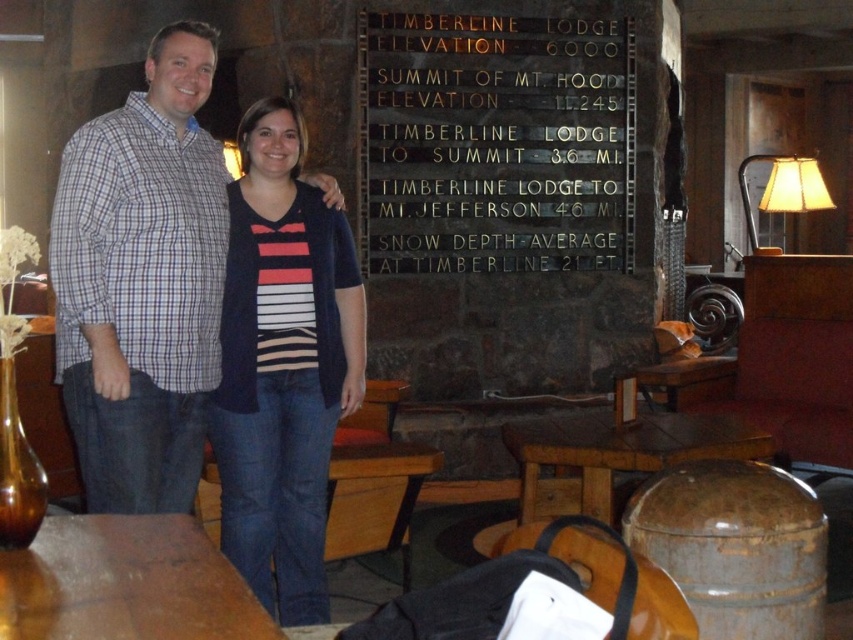
Find the location of `plaid cotton shirt at center`. plaid cotton shirt at center is located at coordinates (142, 282).

Where is `plaid cotton shirt at center`? plaid cotton shirt at center is located at coordinates (142, 282).

This screenshot has width=853, height=640. Find the location of `plaid cotton shirt at center`. plaid cotton shirt at center is located at coordinates [x=142, y=282].

Looking at this image, how distant is striped knit sweater at center from brown wooden table at lower left?

A distance of 4.10 feet exists between striped knit sweater at center and brown wooden table at lower left.

Can you confirm if striped knit sweater at center is taller than brown wooden table at lower left?

Yes.

Where is `striped knit sweater at center`? This screenshot has width=853, height=640. striped knit sweater at center is located at coordinates (282, 365).

The width and height of the screenshot is (853, 640). I want to click on striped knit sweater at center, so click(282, 365).

Who is lower down, brown wooden table at lower left or wooden table at lower center?

wooden table at lower center is below.

Describe the element at coordinates (125, 582) in the screenshot. I see `brown wooden table at lower left` at that location.

The height and width of the screenshot is (640, 853). What do you see at coordinates (125, 582) in the screenshot?
I see `brown wooden table at lower left` at bounding box center [125, 582].

This screenshot has height=640, width=853. Identify the location of brown wooden table at lower left. (125, 582).